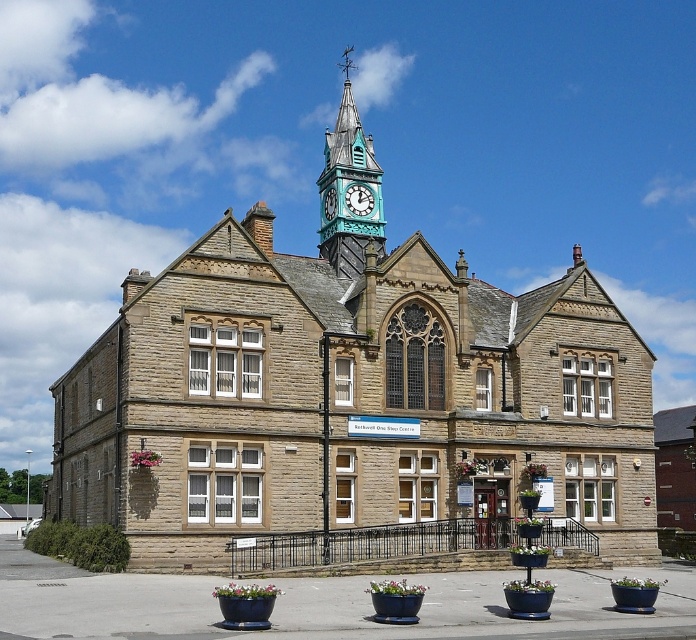
The image size is (696, 640). What do you see at coordinates (348, 390) in the screenshot?
I see `brown stone church at center` at bounding box center [348, 390].

Is brown stone church at center to the left of teal glass clock at upper center from the viewer's perspective?

Indeed, brown stone church at center is positioned on the left side of teal glass clock at upper center.

Which is in front, point (228, 320) or point (361, 189)?

Positioned in front is point (228, 320).

In order to click on brown stone church at center in this screenshot , I will do `click(348, 390)`.

Is teal glass clock at upper center positioned at the back of teal metallic clock at upper center?

Yes, it is behind teal metallic clock at upper center.

Is teal glass clock at upper center to the left of teal metallic clock at upper center from the viewer's perspective?

In fact, teal glass clock at upper center is to the right of teal metallic clock at upper center.

Who is more distant from viewer, (x=351, y=182) or (x=331, y=192)?

Point (x=331, y=192)

You are a GUI agent. You are given a task and a screenshot of the screen. Output one action in this format:
    pyautogui.click(x=<x>, y=<y>)
    Task: Click on the teal glass clock at upper center
    This screenshot has width=696, height=640.
    Given the screenshot: What is the action you would take?
    pyautogui.click(x=358, y=198)

Which is in front, point (351, 188) or point (354, 205)?

Point (354, 205) is more forward.

Based on the photo, who is positioned more to the right, teal glass clock tower at upper center or teal glass clock at upper center?

Positioned to the right is teal glass clock at upper center.

At what (x,y) coordinates should I click in order to perform the action: click on teal glass clock tower at upper center. Please return your answer as a coordinate pair (x, y). This screenshot has height=640, width=696. Looking at the image, I should click on (349, 189).